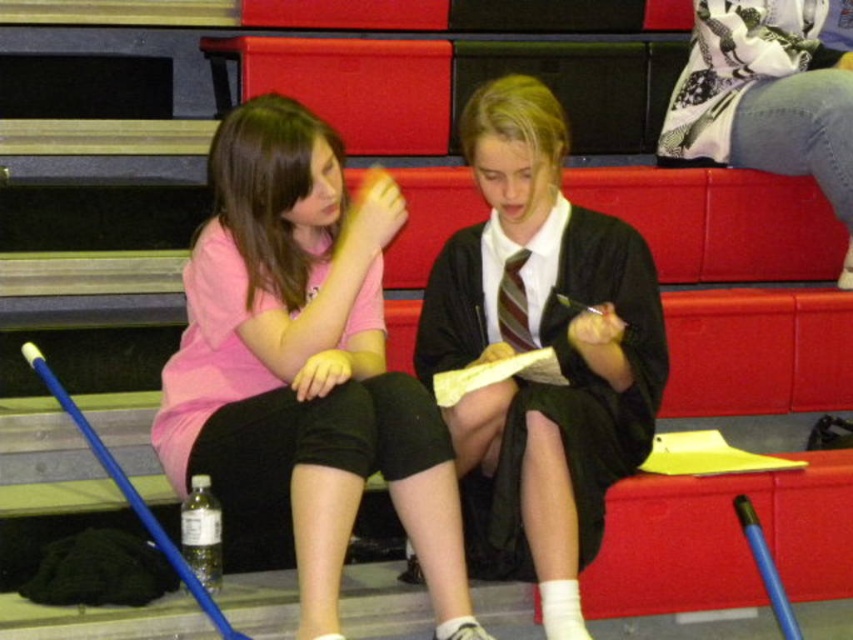
You are standing at the back of the bleachers and want to reach the point marked as point (x=293, y=172). Is this point closer to you than the other point marked as point (x=543, y=179)?

Yes, point (x=293, y=172) is closer to you because it is in front of point (x=543, y=179).

Based on the coordinates provided, which object is located at point (305, 365)?

The point (305, 365) indicates the pink fabric shirt at left.